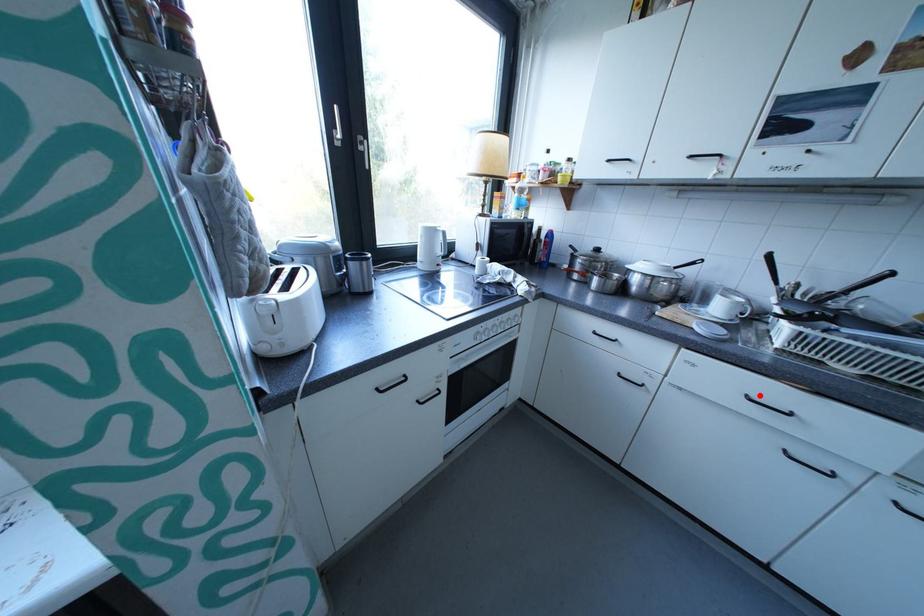
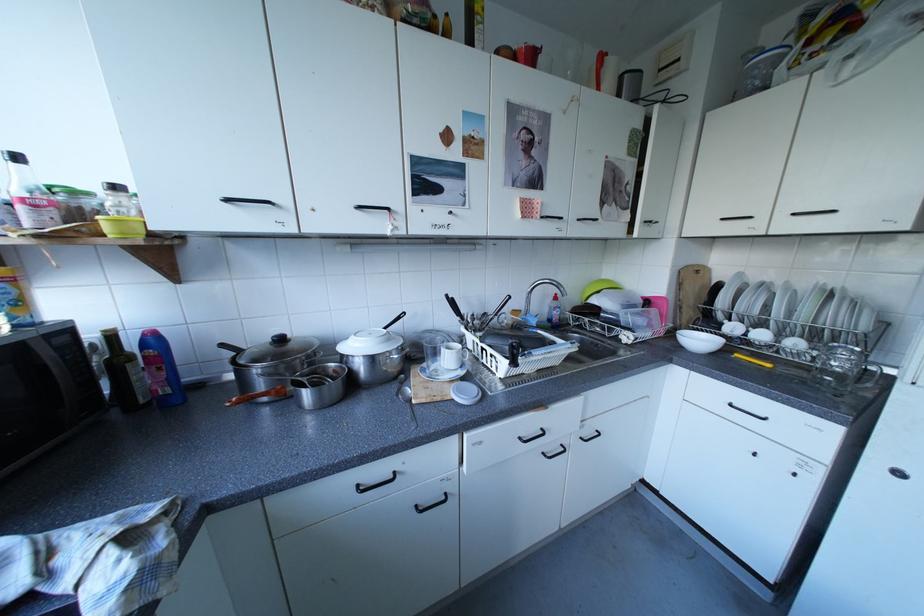
Find the pixel in the second image that matches the highlighted location in the first image.

(532, 439)